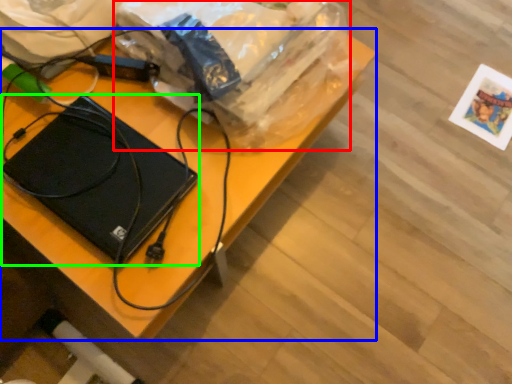
Question: Which object is positioned closest to grocery bag (highlighted by a red box)? Select from desk (highlighted by a blue box) and laptop (highlighted by a green box).

Choices:
 (A) desk
 (B) laptop

Answer: (A)